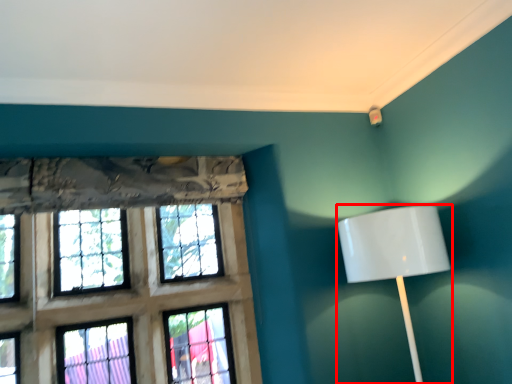
Question: From the image's perspective, considering the relative positions of lamp (annotated by the red box) and window in the image provided, where is lamp (annotated by the red box) located with respect to the staircase?

Choices:
 (A) below
 (B) above

Answer: (B)